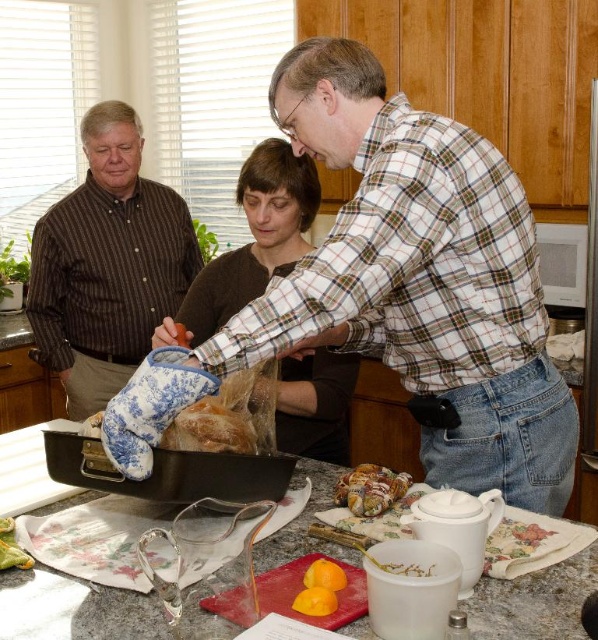
Question: Can you confirm if green leafy vegetable at lower left is positioned to the left of yellow matte orange at center?

Choices:
 (A) yes
 (B) no

Answer: (A)

Question: Which of the following is the closest to the observer?

Choices:
 (A) plaid shirt at center
 (B) metallic silver frying pan at center
 (C) blue floral oven mitt at center

Answer: (A)

Question: Is granite countertop at center above yellow matte orange at center?

Choices:
 (A) no
 (B) yes

Answer: (B)

Question: Which point is farther to the camera?

Choices:
 (A) metallic silver frying pan at center
 (B) brown striped shirt at left

Answer: (B)

Question: Can you confirm if plaid shirt at center is smaller than green leafy vegetable at lower left?

Choices:
 (A) yes
 (B) no

Answer: (B)

Question: Based on their relative distances, which object is nearer to the brown sweater at center?

Choices:
 (A) golden brown bread at center
 (B) metallic silver frying pan at center
 (C) plaid shirt at center

Answer: (C)